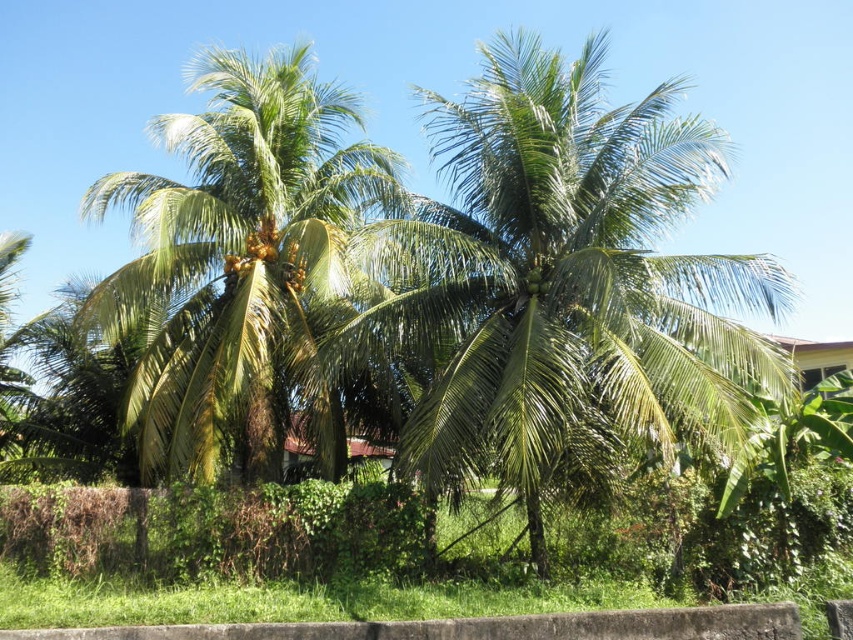
Where is `green leafy coconut tree at center`? green leafy coconut tree at center is located at coordinates (566, 273).

Which is behind, point (715, 129) or point (273, 202)?

The point (273, 202) is behind.

I want to click on green leafy coconut tree at center, so click(x=566, y=273).

I want to click on green leafy coconut tree at center, so click(x=566, y=273).